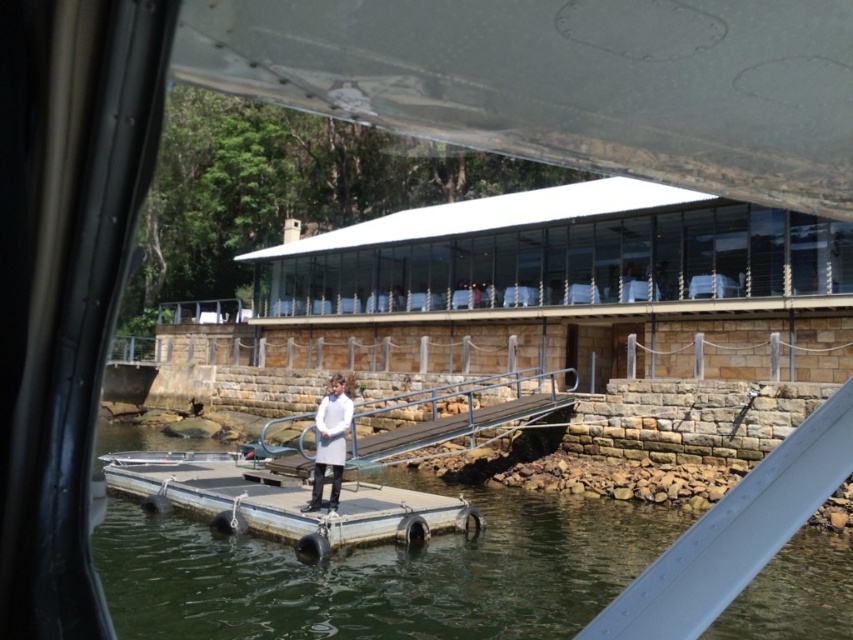
Who is more distant from viewer, (518, 492) or (328, 413)?

The point (518, 492) is behind.

Is clear water at center positioned before white matte coat at center?

That is True.

The height and width of the screenshot is (640, 853). What do you see at coordinates (381, 576) in the screenshot?
I see `clear water at center` at bounding box center [381, 576].

Find the location of a particular element. The width and height of the screenshot is (853, 640). clear water at center is located at coordinates (381, 576).

Is point (824, 572) farther from viewer compared to point (352, 433)?

No.

Is point (151, 616) farther from viewer compared to point (379, 449)?

No, it is in front of (379, 449).

The height and width of the screenshot is (640, 853). What are the coordinates of `clear water at center` in the screenshot? It's located at (381, 576).

Can you confirm if metallic gray rail at center is positioned to the right of white matte coat at center?

Correct, you'll find metallic gray rail at center to the right of white matte coat at center.

Does point (299, 472) come in front of point (326, 444)?

No, it is behind (326, 444).

Is point (422, 388) positioned before point (338, 378)?

No, (422, 388) is further to viewer.

Where is `metallic gray rail at center`? metallic gray rail at center is located at coordinates (451, 413).